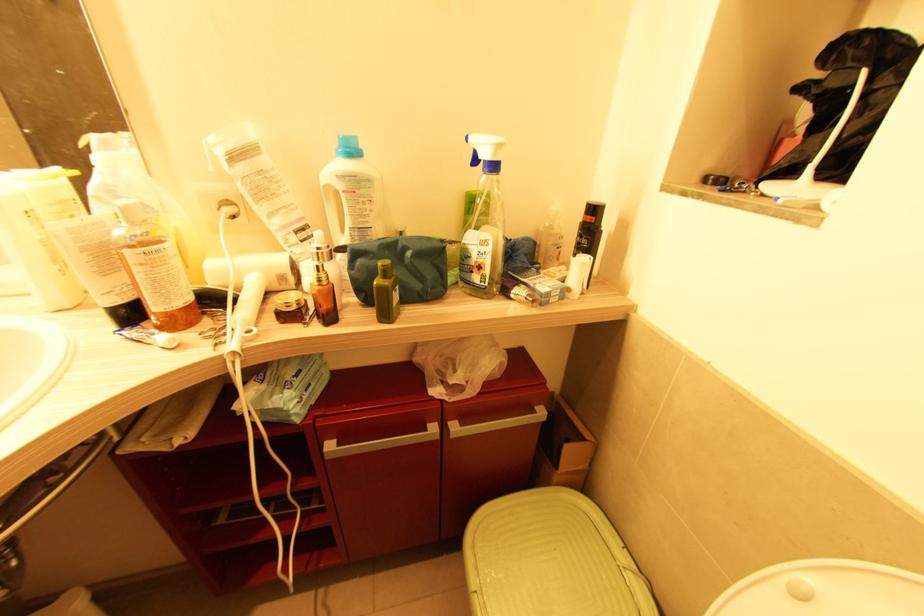
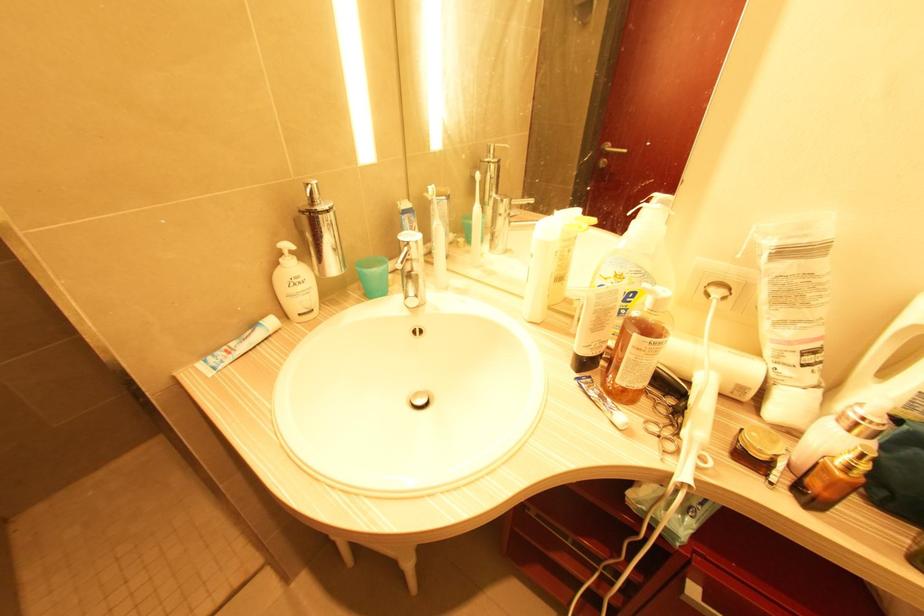
Locate, in the second image, the point that corresponds to (x=321, y=282) in the first image.

(850, 468)